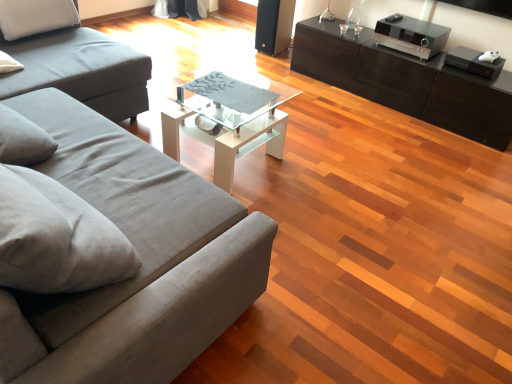
Question: Considering the positions of matte gray fabric studio couch at left, arranged as the 2th studio couch when viewed from the front, and black glossy cabinet at right in the image, is matte gray fabric studio couch at left, arranged as the 2th studio couch when viewed from the front, wider or thinner than black glossy cabinet at right?

Choices:
 (A) thin
 (B) wide

Answer: (B)

Question: Is matte gray fabric studio couch at left, arranged as the 1th studio couch when viewed from the back, in front of or behind black glossy cabinet at right in the image?

Choices:
 (A) front
 (B) behind

Answer: (A)

Question: Which object is the farthest from the black glossy cabinet at right?

Choices:
 (A) matte gray fabric studio couch at left, arranged as the 2th studio couch when viewed from the front
 (B) gray fabric couch at left, the first studio couch when ordered from front to back
 (C) clear glass coffee table at center

Answer: (B)

Question: Estimate the real-world distances between objects in this image. Which object is farther from the black glossy cabinet at right?

Choices:
 (A) clear glass coffee table at center
 (B) gray fabric couch at left, the second studio couch positioned from the back
 (C) matte gray fabric studio couch at left, arranged as the 1th studio couch when viewed from the back

Answer: (B)